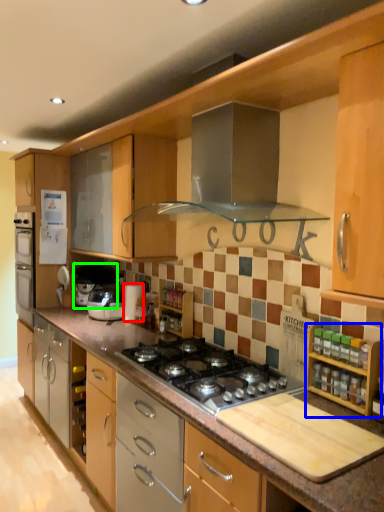
Question: Estimate the real-world distances between objects in this image. Which object is closer to appliance (highlighted by a red box), cabinetry (highlighted by a blue box) or appliance (highlighted by a green box)?

Choices:
 (A) cabinetry
 (B) appliance

Answer: (B)